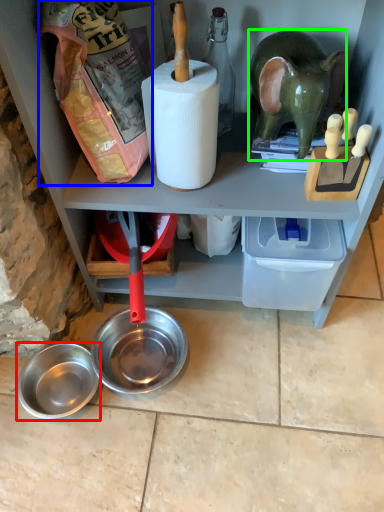
Question: Considering the real-world distances, which object is closest to bowl (highlighted by a red box)? stuff (highlighted by a blue box) or animal (highlighted by a green box).

Choices:
 (A) stuff
 (B) animal

Answer: (A)